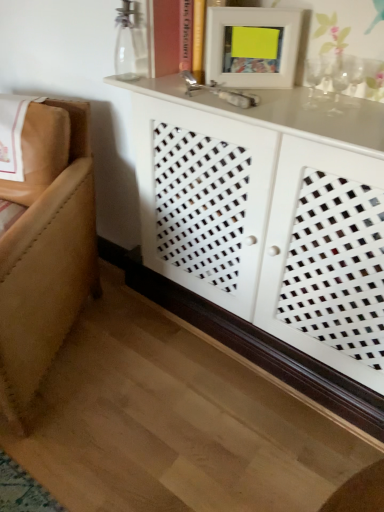
Describe the element at coordinates (269, 234) in the screenshot. I see `white lattice cabinet at center` at that location.

Where is `white lattice cabinet at center`? The image size is (384, 512). white lattice cabinet at center is located at coordinates (269, 234).

You are a GUI agent. You are given a task and a screenshot of the screen. Output one action in this format:
    pyautogui.click(x=<x>, y=<y>)
    Task: Click on the white matte picture frame at upper center
    The width and height of the screenshot is (384, 512).
    Given the screenshot: What is the action you would take?
    pyautogui.click(x=252, y=46)

The image size is (384, 512). I want to click on white lattice cabinet at center, so click(269, 234).

What's the angular difference between tan leather couch at left and white lattice cabinet at center's facing directions?

The angular difference between tan leather couch at left and white lattice cabinet at center is 27.6 degrees.

Looking at this image, is tan leather couch at left bigger or smaller than white lattice cabinet at center?

tan leather couch at left is smaller than white lattice cabinet at center.

Is tan leather couch at left outside of white lattice cabinet at center?

tan leather couch at left lies outside white lattice cabinet at center's area.

From a real-world perspective, which is physically above, tan leather couch at left or white lattice cabinet at center?

From a 3D spatial view, white lattice cabinet at center is above.

This screenshot has height=512, width=384. Find the location of `picture frame above the tan leather couch at left (from the image's perspective)`. picture frame above the tan leather couch at left (from the image's perspective) is located at coordinates (252, 46).

Does white matte picture frame at upper center have a lesser width compared to tan leather couch at left?

Indeed, white matte picture frame at upper center has a lesser width compared to tan leather couch at left.

Can you confirm if white matte picture frame at upper center is shorter than tan leather couch at left?

Yes, white matte picture frame at upper center is shorter than tan leather couch at left.

Can you tell me how much white matte picture frame at upper center and tan leather couch at left differ in facing direction?

The facing directions of white matte picture frame at upper center and tan leather couch at left are 15.3 degrees apart.

Which object is more forward, clear glass vase at upper center or white lattice cabinet at center?

white lattice cabinet at center.

At what (x,y) coordinates should I click in order to perform the action: click on cabinetry that appears below the clear glass vase at upper center (from the image's perspective). Please return your answer as a coordinate pair (x, y). Looking at the image, I should click on (269, 234).

Is point (127, 4) positioned in front of point (335, 232)?

No, (127, 4) is behind (335, 232).

How distant is tan leather couch at left from clear glass vase at upper center?

tan leather couch at left is 21.08 inches away from clear glass vase at upper center.

The image size is (384, 512). What are the coordinates of `furniture below the clear glass vase at upper center (from the image's perspective)` in the screenshot? It's located at (46, 248).

Between tan leather couch at left and clear glass vase at upper center, which one has less height?

clear glass vase at upper center.

Is clear glass vase at upper center located within tan leather couch at left?

No, tan leather couch at left does not contain clear glass vase at upper center.

Between white matte picture frame at upper center and clear glass vase at upper center, which one has less height?

clear glass vase at upper center.

Is white matte picture frame at upper center smaller than clear glass vase at upper center?

No.

From the picture: From the image's perspective, is white matte picture frame at upper center above or below clear glass vase at upper center?

white matte picture frame at upper center is situated lower than clear glass vase at upper center in the image.

From a real-world perspective, is white matte picture frame at upper center above or below clear glass vase at upper center?

white matte picture frame at upper center is above clear glass vase at upper center.

Is white lattice cabinet at center not inside white matte picture frame at upper center?

Yes, white lattice cabinet at center is outside of white matte picture frame at upper center.

Considering the positions of point (367, 417) and point (286, 14), is point (367, 417) closer or farther from the camera than point (286, 14)?

Point (367, 417).

Considering the sizes of white lattice cabinet at center and white matte picture frame at upper center in the image, is white lattice cabinet at center bigger or smaller than white matte picture frame at upper center?

Clearly, white lattice cabinet at center is larger in size than white matte picture frame at upper center.

From a real-world perspective, is white lattice cabinet at center physically above white matte picture frame at upper center?

No, from a real-world perspective, white lattice cabinet at center is not over white matte picture frame at upper center

Does white lattice cabinet at center have a larger size compared to tan leather couch at left?

Indeed, white lattice cabinet at center has a larger size compared to tan leather couch at left.

Where is `cabinetry that appears above the tan leather couch at left (from the image's perspective)`? The width and height of the screenshot is (384, 512). cabinetry that appears above the tan leather couch at left (from the image's perspective) is located at coordinates (269, 234).

Considering the sizes of objects white lattice cabinet at center and tan leather couch at left in the image provided, who is wider, white lattice cabinet at center or tan leather couch at left?

tan leather couch at left.

From a real-world perspective, between white lattice cabinet at center and tan leather couch at left, who is vertically higher?

From a 3D spatial view, white lattice cabinet at center is above.

Identify the location of cabinetry above the tan leather couch at left (from a real-world perspective). The height and width of the screenshot is (512, 384). (269, 234).

At what (x,y) coordinates should I click in order to perform the action: click on furniture that appears in front of the white matte picture frame at upper center. Please return your answer as a coordinate pair (x, y). The width and height of the screenshot is (384, 512). Looking at the image, I should click on (46, 248).

Estimate the real-world distances between objects in this image. Which object is further from white matte picture frame at upper center, clear glass vase at upper center or white lattice cabinet at center?

white lattice cabinet at center lies further to white matte picture frame at upper center than the other object.

Looking at the image, which one is located further to clear glass vase at upper center, white matte picture frame at upper center or tan leather couch at left?

tan leather couch at left lies further to clear glass vase at upper center than the other object.

Estimate the real-world distances between objects in this image. Which object is further from tan leather couch at left, white lattice cabinet at center or white matte picture frame at upper center?

Based on the image, white matte picture frame at upper center appears to be further to tan leather couch at left.

In the scene shown: Based on their spatial positions, is white matte picture frame at upper center or clear glass vase at upper center further from tan leather couch at left?

white matte picture frame at upper center is further to tan leather couch at left.

Considering their positions, is white lattice cabinet at center positioned further to clear glass vase at upper center than white matte picture frame at upper center?

white lattice cabinet at center lies further to clear glass vase at upper center than the other object.

Based on their spatial positions, is clear glass vase at upper center or white lattice cabinet at center further from tan leather couch at left?

clear glass vase at upper center.

When comparing their distances from tan leather couch at left, does clear glass vase at upper center or white matte picture frame at upper center seem further?

white matte picture frame at upper center.

When comparing their distances from white matte picture frame at upper center, does clear glass vase at upper center or tan leather couch at left seem closer?

clear glass vase at upper center is positioned closer to the anchor white matte picture frame at upper center.

I want to click on picture frame between white lattice cabinet at center and clear glass vase at upper center from front to back, so click(252, 46).

Locate an element on the screen. The width and height of the screenshot is (384, 512). glass vase located between tan leather couch at left and white matte picture frame at upper center in the left-right direction is located at coordinates (130, 42).

Where is `glass vase between tan leather couch at left and white lattice cabinet at center`? Image resolution: width=384 pixels, height=512 pixels. glass vase between tan leather couch at left and white lattice cabinet at center is located at coordinates (130, 42).

At what (x,y) coordinates should I click in order to perform the action: click on picture frame between tan leather couch at left and white lattice cabinet at center. Please return your answer as a coordinate pair (x, y). Looking at the image, I should click on (252, 46).